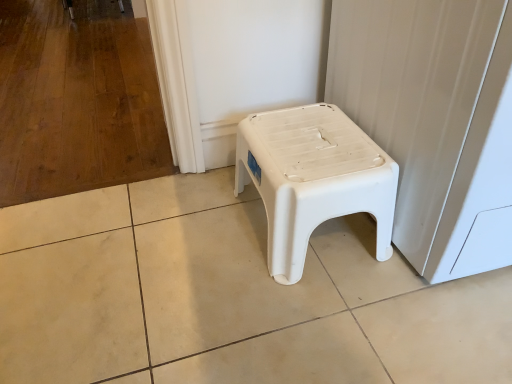
Find the location of a particular element. vacant space to the left of white plastic stool at center is located at coordinates (190, 238).